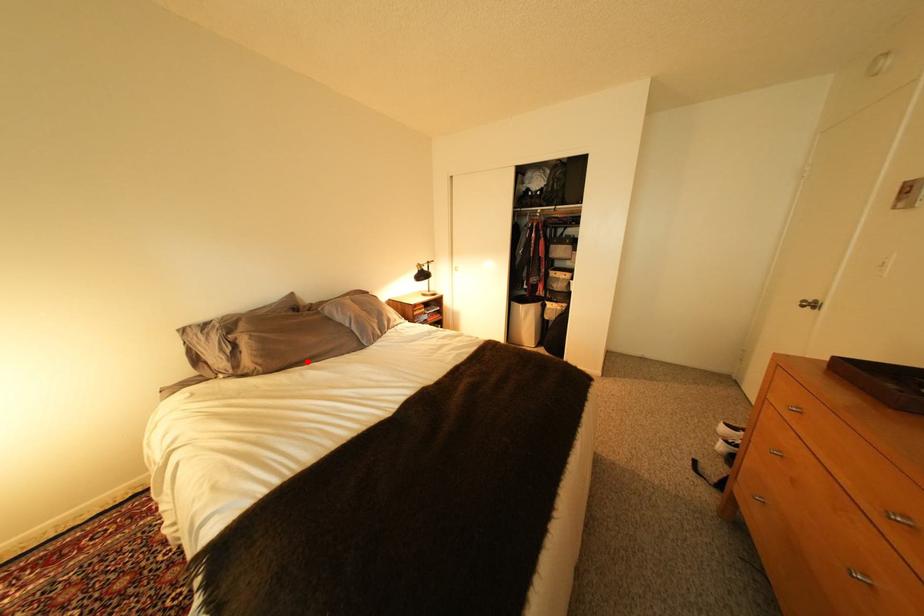
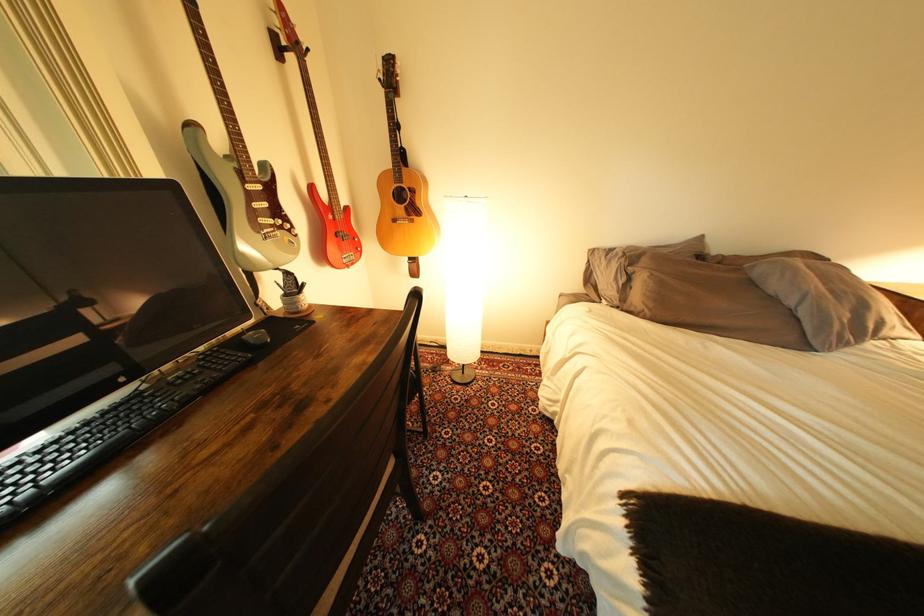
Find the pixel in the second image that matches the highlighted location in the first image.

(701, 322)